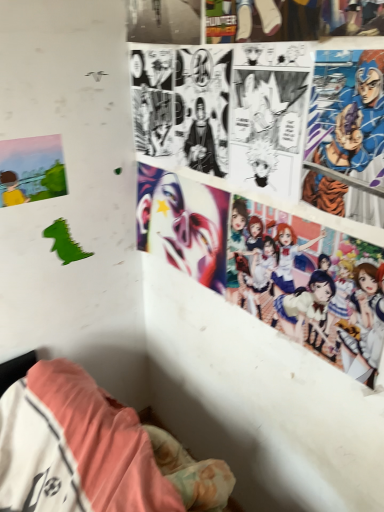
Question: From a real-world perspective, is colorful anime characters at upper right, which is the first person in bottom-to-top order, under blue metallic armor at upper right, marked as the second person in a bottom-to-top arrangement?

Choices:
 (A) yes
 (B) no

Answer: (A)

Question: Is colorful anime characters at upper right, which is counted as the 2th person, starting from the top, looking in the opposite direction of blue metallic armor at upper right, marked as the second person in a bottom-to-top arrangement?

Choices:
 (A) yes
 (B) no

Answer: (B)

Question: Does colorful anime characters at upper right, which is the first person in bottom-to-top order, lie behind blue metallic armor at upper right, marked as the second person in a bottom-to-top arrangement?

Choices:
 (A) yes
 (B) no

Answer: (A)

Question: Would you say colorful anime characters at upper right, which is the first person in bottom-to-top order, contains blue metallic armor at upper right, acting as the 1th person starting from the top?

Choices:
 (A) yes
 (B) no

Answer: (B)

Question: From the image's perspective, would you say colorful anime characters at upper right, which is counted as the 2th person, starting from the top, is shown under blue metallic armor at upper right, acting as the 1th person starting from the top?

Choices:
 (A) no
 (B) yes

Answer: (B)

Question: Is colorful anime characters at upper right, which is the first person in bottom-to-top order, smaller than blue metallic armor at upper right, acting as the 1th person starting from the top?

Choices:
 (A) yes
 (B) no

Answer: (B)

Question: From a real-world perspective, is matte paper poster at left beneath shiny metallic mask at center?

Choices:
 (A) no
 (B) yes

Answer: (A)

Question: Does matte paper poster at left have a lesser width compared to shiny metallic mask at center?

Choices:
 (A) no
 (B) yes

Answer: (B)

Question: Considering the relative sizes of matte paper poster at left and shiny metallic mask at center in the image provided, is matte paper poster at left shorter than shiny metallic mask at center?

Choices:
 (A) yes
 (B) no

Answer: (A)

Question: Can you confirm if matte paper poster at left is bigger than shiny metallic mask at center?

Choices:
 (A) yes
 (B) no

Answer: (B)

Question: Is matte paper poster at left far from shiny metallic mask at center?

Choices:
 (A) no
 (B) yes

Answer: (A)

Question: Is matte paper poster at left directly adjacent to shiny metallic mask at center?

Choices:
 (A) no
 (B) yes

Answer: (A)

Question: Can you confirm if colorful anime characters at upper right, which is the first person in bottom-to-top order, is taller than matte paper poster at left?

Choices:
 (A) no
 (B) yes

Answer: (B)